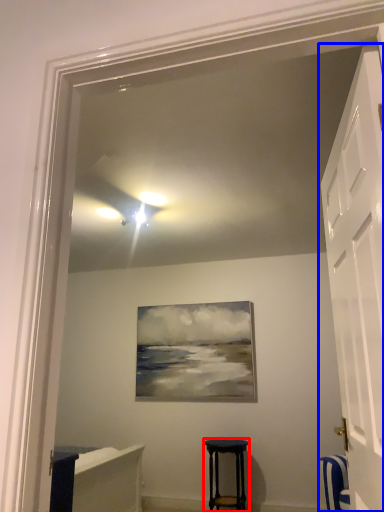
Question: Which object appears farthest to the camera in this image, stool (highlighted by a red box) or door (highlighted by a blue box)?

Choices:
 (A) stool
 (B) door

Answer: (A)